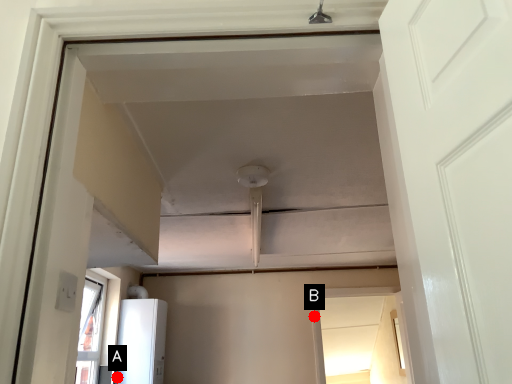
Question: Two points are circled on the image, labeled by A and B beside each circle. Which point is farther from the camera taking this photo?

Choices:
 (A) A is further
 (B) B is further

Answer: (B)